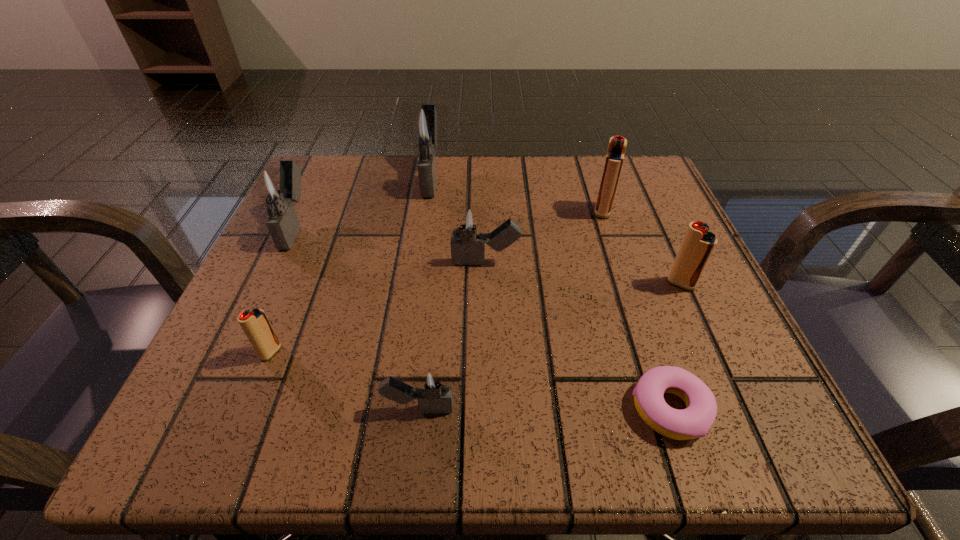
Where is `the biggest gray igniter`? The width and height of the screenshot is (960, 540). the biggest gray igniter is located at coordinates (423, 126).

Where is `the tallest object`? The image size is (960, 540). the tallest object is located at coordinates (423, 126).

I want to click on the sixth igniter from left to right, so click(617, 145).

Find the location of a particular element. The height and width of the screenshot is (540, 960). the second red igniter from left to right is located at coordinates (617, 145).

The height and width of the screenshot is (540, 960). I want to click on the leftmost gray igniter, so click(x=277, y=188).

You are a GUI agent. You are given a task and a screenshot of the screen. Output one action in this format:
    pyautogui.click(x=<x>, y=<y>)
    Task: Click on the second smallest gray igniter
    This screenshot has height=540, width=960.
    Given the screenshot: What is the action you would take?
    pyautogui.click(x=466, y=222)

At what (x,y) coordinates should I click in order to perform the action: click on the second biggest red igniter. Please return your answer as a coordinate pair (x, y). Looking at the image, I should click on click(698, 244).

You are a GUI agent. You are given a task and a screenshot of the screen. Output one action in this format:
    pyautogui.click(x=<x>, y=<y>)
    Task: Click on the rightmost object
    
    Given the screenshot: What is the action you would take?
    pyautogui.click(x=698, y=244)

Identify the location of the sixth farthest object. pos(255,324).

Image resolution: width=960 pixels, height=540 pixels. Identify the location of the sixth farthest igniter. (255, 324).